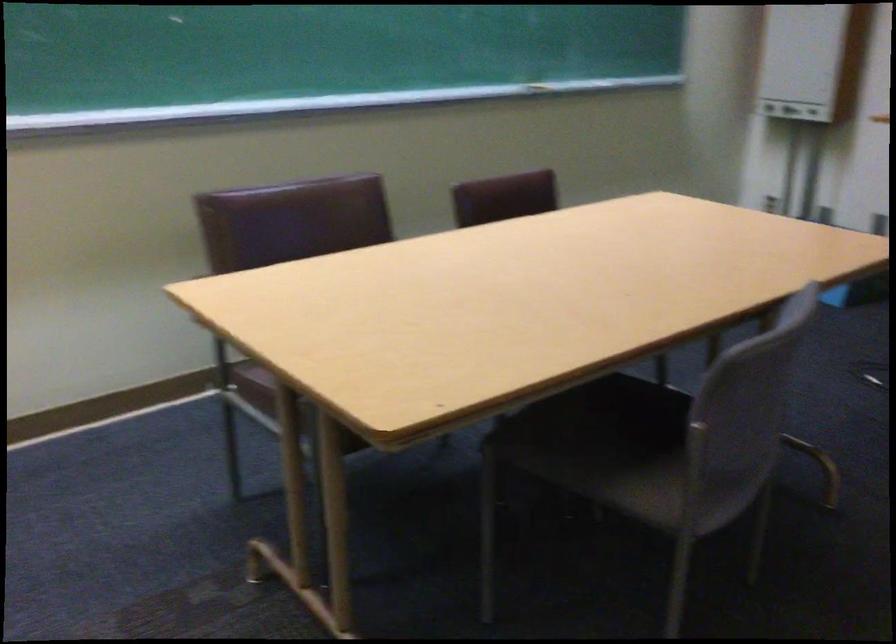
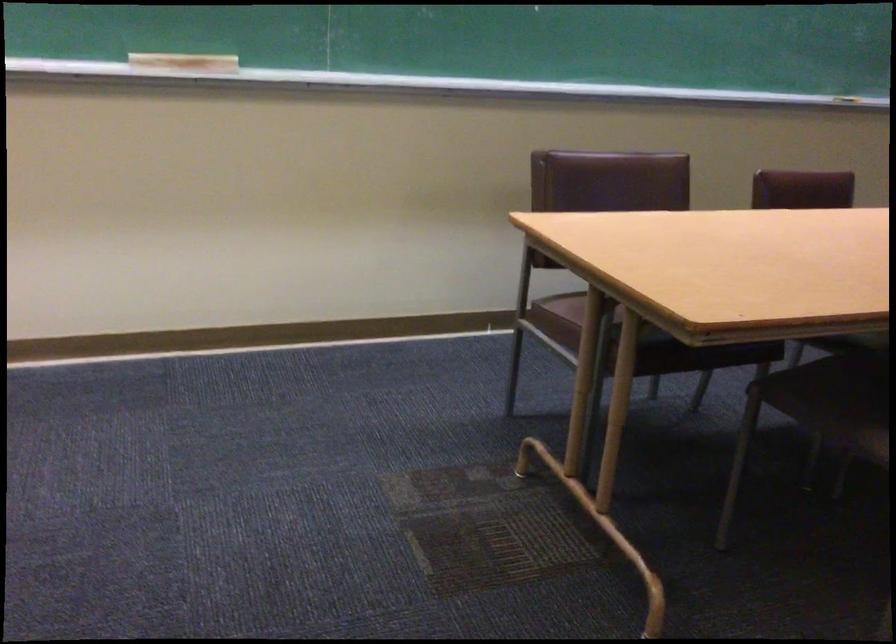
Question: The camera is either moving clockwise (left) or counter-clockwise (right) around the object. The first image is from the beginning of the video and the second image is from the end. Is the camera moving left or right when shooting the video?

Choices:
 (A) Left
 (B) Right

Answer: (B)